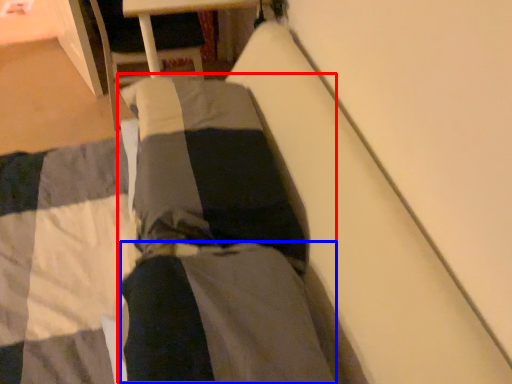
Question: Which object is further to the camera taking this photo, couple (highlighted by a red box) or pants (highlighted by a blue box)?

Choices:
 (A) couple
 (B) pants

Answer: (A)